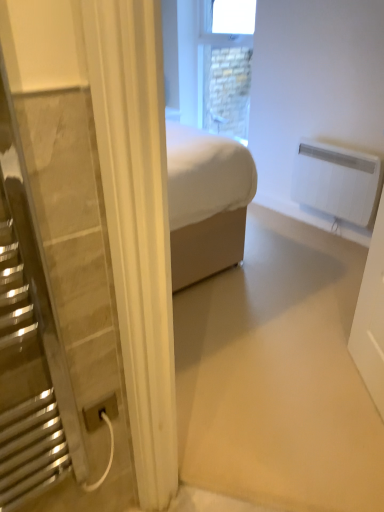
Question: From their relative heights in the image, would you say white plastic power plug at lower left is taller or shorter than white plastic radiator at upper right?

Choices:
 (A) short
 (B) tall

Answer: (A)

Question: Does point (82, 415) appear closer or farther from the camera than point (334, 207)?

Choices:
 (A) closer
 (B) farther

Answer: (A)

Question: Considering the real-world distances, which object is farthest from the white plastic power plug at lower left?

Choices:
 (A) stone textured window at upper center
 (B) white plastic radiator at upper right

Answer: (A)

Question: Which object is positioned closest to the white plastic radiator at upper right?

Choices:
 (A) white plastic power plug at lower left
 (B) stone textured window at upper center

Answer: (B)